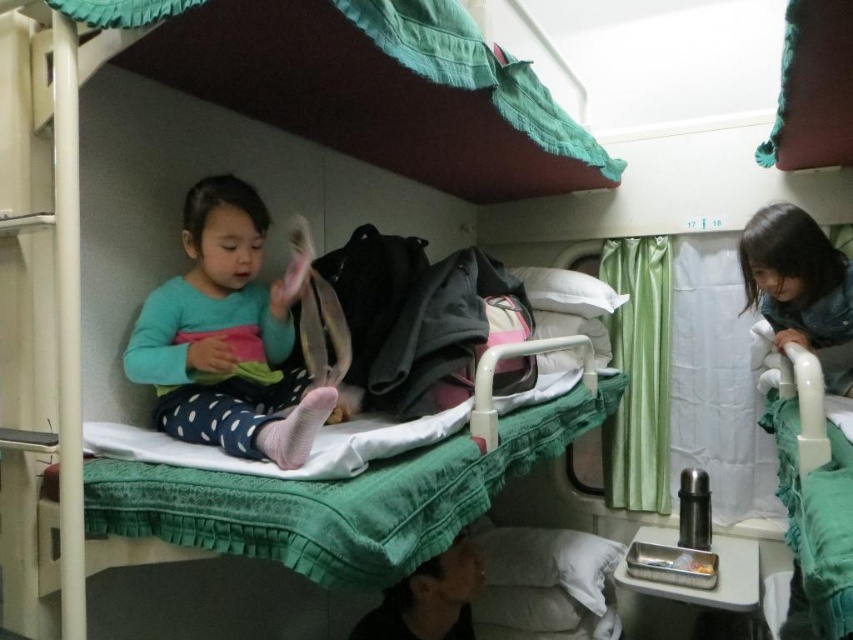
Which is behind, point (656, 388) or point (846, 385)?

Point (656, 388)

Is green satin curtain at right to the left of smooth denim jacket at upper right from the viewer's perspective?

Yes, green satin curtain at right is to the left of smooth denim jacket at upper right.

Is point (614, 440) closer to camera compared to point (828, 257)?

No, it is not.

The image size is (853, 640). I want to click on green satin curtain at right, so click(637, 372).

Can you confirm if matte teal shirt at center is positioned to the left of green satin curtain at right?

Correct, you'll find matte teal shirt at center to the left of green satin curtain at right.

Consider the image. Is matte teal shirt at center bigger than green satin curtain at right?

Indeed, matte teal shirt at center has a larger size compared to green satin curtain at right.

Does point (242, 362) come in front of point (614, 260)?

That is True.

You are a GUI agent. You are given a task and a screenshot of the screen. Output one action in this format:
    pyautogui.click(x=<x>, y=<y>)
    Task: Click on the matte teal shirt at center
    
    Given the screenshot: What is the action you would take?
    pyautogui.click(x=225, y=339)

In the scene shown: Can you confirm if matte teal shirt at center is wider than smooth denim jacket at upper right?

Indeed, matte teal shirt at center has a greater width compared to smooth denim jacket at upper right.

Who is more forward, (x=212, y=337) or (x=791, y=228)?

Positioned in front is point (x=212, y=337).

This screenshot has width=853, height=640. Identify the location of matte teal shirt at center. (225, 339).